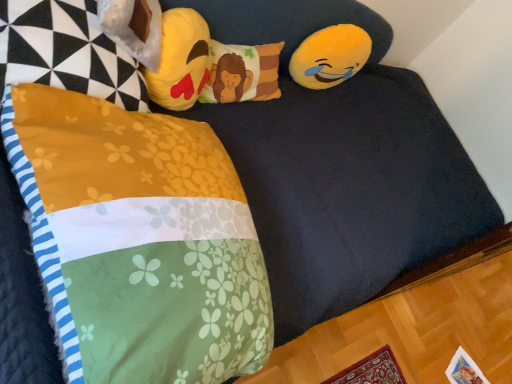
Question: Is yellow plush emoji at upper right, the first toy positioned from the right, placed right next to soft yellow plush emoji at upper center, marked as the second toy in a right-to-left arrangement?

Choices:
 (A) no
 (B) yes

Answer: (A)

Question: Considering the relative sizes of yellow plush emoji at upper right, which is the 2th toy in front-to-back order, and soft yellow plush emoji at upper center, the first toy positioned from the left, in the image provided, is yellow plush emoji at upper right, which is the 2th toy in front-to-back order, thinner than soft yellow plush emoji at upper center, the first toy positioned from the left,?

Choices:
 (A) no
 (B) yes

Answer: (B)

Question: From a real-world perspective, does yellow plush emoji at upper right, the first toy positioned from the right, stand above soft yellow plush emoji at upper center, the first toy positioned from the front?

Choices:
 (A) no
 (B) yes

Answer: (A)

Question: Is yellow plush emoji at upper right, which is the first toy in back-to-front order, bigger than soft yellow plush emoji at upper center, the second toy when ordered from back to front?

Choices:
 (A) no
 (B) yes

Answer: (A)

Question: Is yellow plush emoji at upper right, marked as the 2th toy in a left-to-right arrangement, positioned with its back to soft yellow plush emoji at upper center, the first toy positioned from the left?

Choices:
 (A) yes
 (B) no

Answer: (B)

Question: Can we say yellow plush emoji at upper right, which is the 2th toy in front-to-back order, lies outside soft yellow plush emoji at upper center, marked as the second toy in a right-to-left arrangement?

Choices:
 (A) yes
 (B) no

Answer: (A)

Question: Considering the relative positions of soft yellow plush emoji at upper center, marked as the second toy in a right-to-left arrangement, and fluffy floral blanket at lower left, the second pillow when ordered from back to front, in the image provided, is soft yellow plush emoji at upper center, marked as the second toy in a right-to-left arrangement, to the right of fluffy floral blanket at lower left, the second pillow when ordered from back to front, from the viewer's perspective?

Choices:
 (A) yes
 (B) no

Answer: (B)

Question: Could you tell me if soft yellow plush emoji at upper center, marked as the second toy in a right-to-left arrangement, is turned towards fluffy floral blanket at lower left, marked as the second pillow in a top-to-bottom arrangement?

Choices:
 (A) no
 (B) yes

Answer: (B)

Question: Can you confirm if soft yellow plush emoji at upper center, the first toy positioned from the left, is positioned to the left of fluffy floral blanket at lower left, marked as the second pillow in a top-to-bottom arrangement?

Choices:
 (A) no
 (B) yes

Answer: (B)

Question: Is soft yellow plush emoji at upper center, the first toy positioned from the front, further to the viewer compared to fluffy floral blanket at lower left, the second pillow when ordered from back to front?

Choices:
 (A) no
 (B) yes

Answer: (B)

Question: From a real-world perspective, is soft yellow plush emoji at upper center, the second toy when ordered from back to front, physically below fluffy floral blanket at lower left, the second pillow when ordered from back to front?

Choices:
 (A) yes
 (B) no

Answer: (A)

Question: Does soft yellow plush emoji at upper center, the second toy when ordered from back to front, have a larger size compared to fluffy floral blanket at lower left, the second pillow when ordered from back to front?

Choices:
 (A) yes
 (B) no

Answer: (B)

Question: Is fluffy floral blanket at lower left, which is counted as the 1th pillow, starting from the bottom, thinner than floral fabric pillow at center, arranged as the first pillow when viewed from the back?

Choices:
 (A) yes
 (B) no

Answer: (B)